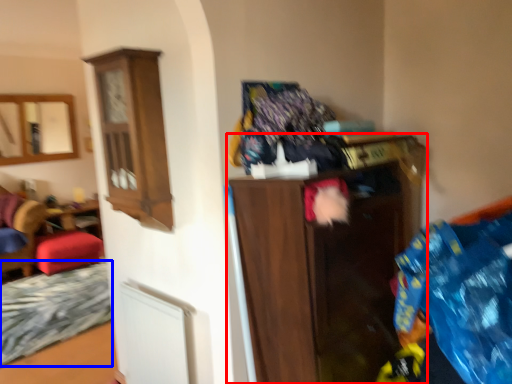
Question: Which object is closer to the camera taking this photo, shelf (highlighted by a red box) or bed frame (highlighted by a blue box)?

Choices:
 (A) shelf
 (B) bed frame

Answer: (A)